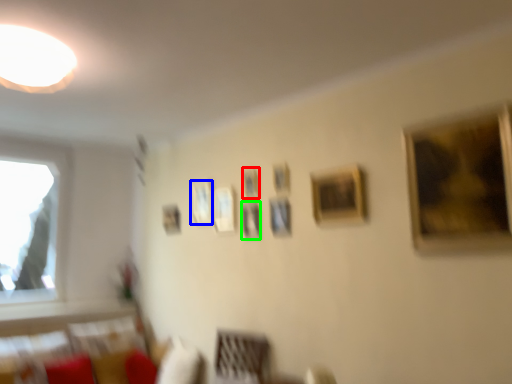
Question: Considering the real-world distances, which object is farthest from picture frame (highlighted by a red box)? picture frame (highlighted by a blue box) or picture frame (highlighted by a green box)?

Choices:
 (A) picture frame
 (B) picture frame

Answer: (A)